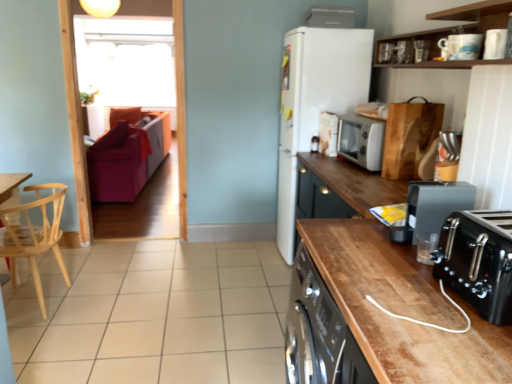
Based on the photo, measure the distance between velvet purple armchair at left and camera.

The depth of velvet purple armchair at left is 4.45 meters.

What are the coordinates of `silver metallic microwave at upper right, placed as the 3th kitchen appliance when sorted from bottom to top` in the screenshot? It's located at (361, 141).

Image resolution: width=512 pixels, height=384 pixels. I want to click on black plastic toaster at right, placed as the first kitchen appliance when sorted from bottom to top, so [478, 261].

How much space does black plastic toaster at right, acting as the 1th kitchen appliance starting from the front, occupy horizontally?

The width of black plastic toaster at right, acting as the 1th kitchen appliance starting from the front, is 27.66 centimeters.

Describe the element at coordinates (460, 46) in the screenshot. I see `white glossy mug at upper center, which is the 5th appliance in back-to-front order` at that location.

Find the location of a particular element. This screenshot has width=512, height=384. white glossy mug at upper center, which is the 5th appliance in back-to-front order is located at coordinates (460, 46).

What do you see at coordinates (396, 291) in the screenshot? I see `black wood countertop at lower right` at bounding box center [396, 291].

Locate an element on the screen. Image resolution: width=512 pixels, height=384 pixels. white glossy microwave at upper right, which is counted as the first appliance, starting from the bottom is located at coordinates (328, 133).

Locate an element on the screen. The width and height of the screenshot is (512, 384). velvet purple armchair at left is located at coordinates (127, 154).

From a real-world perspective, who is located higher, white matte refrigerator at center or black wood countertop at lower right?

white matte refrigerator at center is physically above.

Is white matte refrigerator at center in front of or behind black wood countertop at lower right in the image?

Visually, white matte refrigerator at center is located behind black wood countertop at lower right.

Is point (341, 95) positioned before point (303, 219)?

Yes, point (341, 95) is in front of point (303, 219).

In the scene shown: How far apart are white matte refrigerator at center and black wood countertop at lower right?

white matte refrigerator at center and black wood countertop at lower right are 3.61 feet apart.

From the image's perspective, which one is positioned higher, metallic gray coffee machine at right, which ranks as the 2th kitchen appliance in bottom-to-top order, or silver metallic microwave at upper right, placed as the 3th kitchen appliance when sorted from bottom to top?

From the image's view, silver metallic microwave at upper right, placed as the 3th kitchen appliance when sorted from bottom to top, is above.

Would you say metallic gray coffee machine at right, which is counted as the 2th kitchen appliance, starting from the front, is a long distance from silver metallic microwave at upper right, which appears as the first kitchen appliance when viewed from the back?

Absolutely, metallic gray coffee machine at right, which is counted as the 2th kitchen appliance, starting from the front, is distant from silver metallic microwave at upper right, which appears as the first kitchen appliance when viewed from the back.

Can you confirm if metallic gray coffee machine at right, which is counted as the 2th kitchen appliance, starting from the front, is shorter than silver metallic microwave at upper right, which ranks as the first kitchen appliance in top-to-bottom order?

Correct, metallic gray coffee machine at right, which is counted as the 2th kitchen appliance, starting from the front, is not as tall as silver metallic microwave at upper right, which ranks as the first kitchen appliance in top-to-bottom order.

From a real-world perspective, is metallic gray coffee machine at right, marked as the second kitchen appliance in a top-to-bottom arrangement, over silver metallic microwave at upper right, placed as the 3th kitchen appliance when sorted from bottom to top?

No, from a real-world perspective, metallic gray coffee machine at right, marked as the second kitchen appliance in a top-to-bottom arrangement, is not on top of silver metallic microwave at upper right, placed as the 3th kitchen appliance when sorted from bottom to top.

Is velvet purple armchair at left situated inside light wood chair at left or outside?

velvet purple armchair at left is not inside light wood chair at left, it's outside.

Is velvet purple armchair at left in front of or behind light wood chair at left in the image?

velvet purple armchair at left is behind light wood chair at left.

Which of these two, velvet purple armchair at left or light wood chair at left, is thinner?

With smaller width is light wood chair at left.

From a real-world perspective, is velvet purple armchair at left physically above light wood chair at left?

Yes, from a real-world perspective, velvet purple armchair at left is over light wood chair at left

Based on the photo, from the image's perspective, is white glossy mug at upper center, the 4th appliance in the top-to-bottom sequence, below matte white coffee maker at upper center, positioned as the 4th appliance in left-to-right order?

Yes, from the image's perspective, white glossy mug at upper center, the 4th appliance in the top-to-bottom sequence, is beneath matte white coffee maker at upper center, positioned as the 4th appliance in left-to-right order.

Is white glossy mug at upper center, which is the 5th appliance in back-to-front order, smaller than matte white coffee maker at upper center, positioned as the 4th appliance in left-to-right order?

Indeed, white glossy mug at upper center, which is the 5th appliance in back-to-front order, has a smaller size compared to matte white coffee maker at upper center, positioned as the 4th appliance in left-to-right order.

Is white glossy mug at upper center, which is the 3th appliance from bottom to top, inside or outside of matte white coffee maker at upper center, the first appliance from the top?

white glossy mug at upper center, which is the 3th appliance from bottom to top, cannot be found inside matte white coffee maker at upper center, the first appliance from the top.

Are metallic gray coffee machine at right, which is the second kitchen appliance from back to front, and beige tile at lower center making contact?

No, metallic gray coffee machine at right, which is the second kitchen appliance from back to front, is not making contact with beige tile at lower center.

Can you tell me how much metallic gray coffee machine at right, which ranks as the 2th kitchen appliance in bottom-to-top order, and beige tile at lower center differ in facing direction?

86.5 degrees separate the facing orientations of metallic gray coffee machine at right, which ranks as the 2th kitchen appliance in bottom-to-top order, and beige tile at lower center.

Which is further, (424, 208) or (70, 268)?

The point (70, 268) is more distant.

From the picture: Does metallic gray coffee machine at right, which ranks as the 2th kitchen appliance in bottom-to-top order, have a lesser width compared to beige tile at lower center?

Yes.

Considering the relative sizes of metallic silver toaster at upper right, which ranks as the 1th appliance in right-to-left order, and velvet purple armchair at left in the image provided, is metallic silver toaster at upper right, which ranks as the 1th appliance in right-to-left order, wider than velvet purple armchair at left?

In fact, metallic silver toaster at upper right, which ranks as the 1th appliance in right-to-left order, might be narrower than velvet purple armchair at left.

Is metallic silver toaster at upper right, the third appliance positioned from the front, in front of velvet purple armchair at left?

Yes, it is.

Which object is positioned more to the left, metallic silver toaster at upper right, positioned as the 3th appliance in top-to-bottom order, or velvet purple armchair at left?

velvet purple armchair at left.

How many degrees apart are the facing directions of metallic silver toaster at upper right, positioned as the 3th appliance in top-to-bottom order, and velvet purple armchair at left?

1.28 degrees.

Is white glossy mug at upper center, the 2th appliance from the front, taller or shorter than beige tile at lower center?

Considering their sizes, white glossy mug at upper center, the 2th appliance from the front, has more height than beige tile at lower center.

Which of these two, white glossy mug at upper center, which is the 5th appliance in back-to-front order, or beige tile at lower center, is bigger?

Bigger between the two is beige tile at lower center.

Is white glossy mug at upper center, the 2th appliance from the front, positioned with its back to beige tile at lower center?

No.

Are white glossy mug at upper center, the 4th appliance in the top-to-bottom sequence, and beige tile at lower center making contact?

white glossy mug at upper center, the 4th appliance in the top-to-bottom sequence, and beige tile at lower center are not in contact.

Image resolution: width=512 pixels, height=384 pixels. Identify the location of cabinetry below the white matte refrigerator at center (from the image's perspective). (396, 291).

The image size is (512, 384). What are the coordinates of `kitchen appliance that is above the metallic gray coffee machine at right, marked as the second kitchen appliance in a top-to-bottom arrangement (from the image's perspective)` in the screenshot? It's located at (361, 141).

Which object lies further to the anchor point metallic silver toaster at upper right, the fifth appliance when ordered from left to right, light wood chair at left or white glossy mug at upper center, which is the 5th appliance in back-to-front order?

light wood chair at left lies further to metallic silver toaster at upper right, the fifth appliance when ordered from left to right, than the other object.

From the image, which object appears to be nearer to white matte refrigerator at center, black wood countertop at lower right or transparent glass window screen at upper left?

black wood countertop at lower right.

Looking at the image, which one is located closer to silver metallic microwave at upper right, placed as the 3th kitchen appliance when sorted from bottom to top, black plastic toaster at right, the 3th kitchen appliance from the top, or black wood countertop at lower right?

black wood countertop at lower right lies closer to silver metallic microwave at upper right, placed as the 3th kitchen appliance when sorted from bottom to top, than the other object.

Considering their positions, is white glossy microwave at upper right, the 5th appliance in the front-to-back sequence, positioned closer to light wood chair at left than beige tile at lower center?

beige tile at lower center is positioned closer to the anchor light wood chair at left.

Based on their spatial positions, is velvet purple armchair at left or black plastic toaster at right, which is the 3th kitchen appliance from back to front, further from beige tile at lower center?

velvet purple armchair at left is positioned further to the anchor beige tile at lower center.

Estimate the real-world distances between objects in this image. Which object is further from silver metallic microwave at upper right, which appears as the first kitchen appliance when viewed from the back, white matte refrigerator at center or white glossy microwave at upper right, the 1th appliance in the left-to-right sequence?

white matte refrigerator at center is positioned further to the anchor silver metallic microwave at upper right, which appears as the first kitchen appliance when viewed from the back.

Based on their spatial positions, is beige tile at lower center or white glossy mug at upper center, placed as the fifth appliance when sorted from right to left, closer to silver metallic microwave at upper right, which is the third kitchen appliance from front to back?

white glossy mug at upper center, placed as the fifth appliance when sorted from right to left.

From the image, which object appears to be farther from white matte refrigerator at center, black plastic toaster at right, placed as the first kitchen appliance when sorted from bottom to top, or light wood chair at left?

black plastic toaster at right, placed as the first kitchen appliance when sorted from bottom to top.

Locate an element on the screen. The image size is (512, 384). kitchen appliance between metallic gray coffee machine at right, marked as the second kitchen appliance in a top-to-bottom arrangement, and white matte refrigerator at center from front to back is located at coordinates (361, 141).

Find the location of a particular element. kitchen appliance between metallic gray coffee machine at right, which is the second kitchen appliance from back to front, and metallic silver toaster at upper right, the third appliance positioned from the front, in the front-back direction is located at coordinates (361, 141).

You are a GUI agent. You are given a task and a screenshot of the screen. Output one action in this format:
    pyautogui.click(x=<x>, y=<y>)
    Task: Click on the refrigerator between velvet purple armchair at left and metallic silver toaster at upper right, which ranks as the 1th appliance in right-to-left order, in the horizontal direction
    Image resolution: width=512 pixels, height=384 pixels.
    Given the screenshot: What is the action you would take?
    pyautogui.click(x=315, y=101)

Find the location of a particular element. refrigerator between white glossy microwave at upper right, placed as the second appliance when sorted from back to front, and metallic silver toaster at upper right, which ranks as the 1th appliance in right-to-left order, in the horizontal direction is located at coordinates (315, 101).